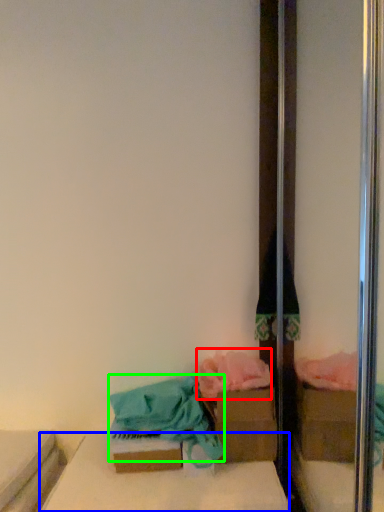
Question: Estimate the real-world distances between objects in this image. Which object is farther from material (highlighted by a red box), furniture (highlighted by a blue box) or material (highlighted by a green box)?

Choices:
 (A) furniture
 (B) material

Answer: (A)